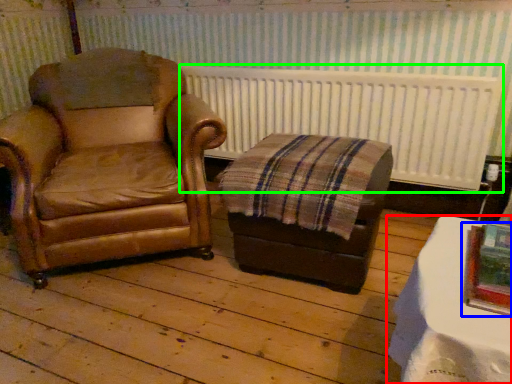
Question: Estimate the real-world distances between objects in this image. Which object is closer to table (highlighted by a red box), picture frame (highlighted by a blue box) or radiator (highlighted by a green box)?

Choices:
 (A) picture frame
 (B) radiator

Answer: (A)